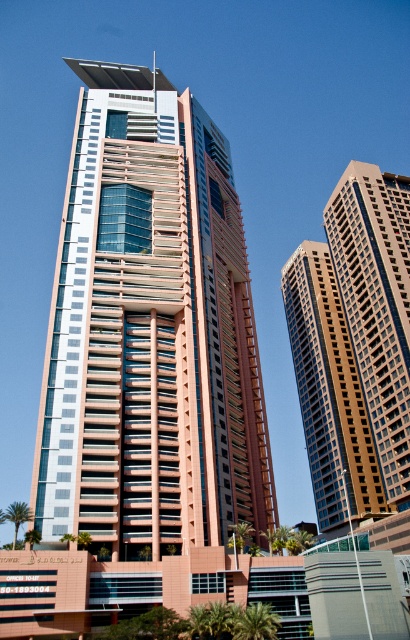
You are a drone operator who needs to deliver a package between the two buildings. The drone has a maximum flight range of 30 meters. Can the drone safely fly between the matte pink glass building at center and the brown textured building at right without exceeding its range?

The distance between the matte pink glass building at center and the brown textured building at right is 32.15 meters, which exceeds the drone operator stated maximum flight range of 30 meters. Therefore, the drone cannot safely fly between them without exceeding its range.

You are a drone operator trying to navigate between two buildings in the city. You see the brown textured building at right and the brown glass building at right. Which building should you fly towards if you want to go east?

The brown textured building at right is to the right of the brown glass building at right. Since you want to go east, you should fly towards the brown textured building at right because it is positioned further east compared to the brown glass building at right.

You are an architect reviewing a cityscape design. You need to determine the spatial relationship between the matte pink glass building at center and the brown textured building at right. Based on the provided scene, which building is positioned higher in the image?

The matte pink glass building at center is located above the brown textured building at right, so it is positioned higher in the image.